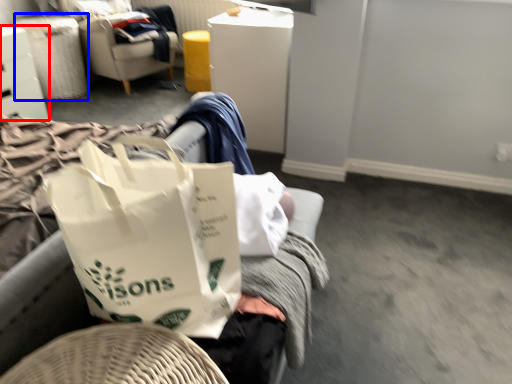
Question: Among these objects, which one is farthest to the camera, furniture (highlighted by a red box) or laundry basket (highlighted by a blue box)?

Choices:
 (A) furniture
 (B) laundry basket

Answer: (B)